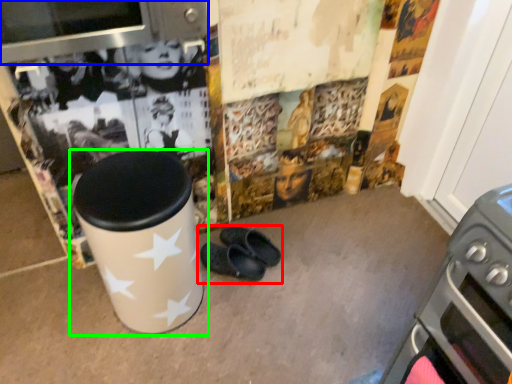
Question: Considering the real-world distances, which object is closest to footwear (highlighted by a red box)? appliance (highlighted by a blue box) or waste container (highlighted by a green box).

Choices:
 (A) appliance
 (B) waste container

Answer: (B)